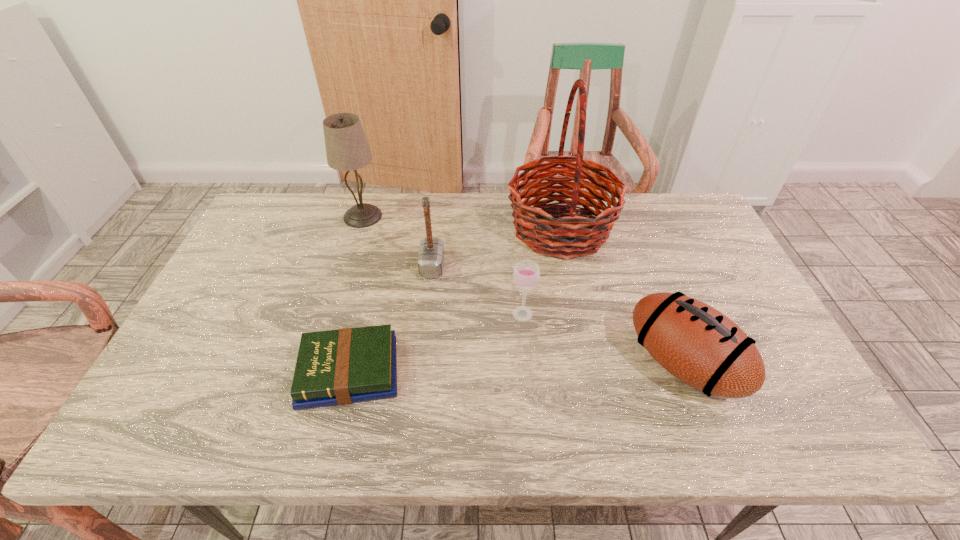
This screenshot has height=540, width=960. I want to click on object located in the near right corner section of the desktop, so tap(699, 345).

What are the coordinates of `vacant space at the far edge of the desktop` in the screenshot? It's located at (483, 224).

At what (x,y) coordinates should I click in order to perform the action: click on vacant space at the near edge of the desktop. Please return your answer as a coordinate pair (x, y). This screenshot has width=960, height=540. Looking at the image, I should click on (319, 430).

Identify the location of free region at the left edge. (172, 392).

The image size is (960, 540). I want to click on vacant space at the right edge, so click(780, 373).

Image resolution: width=960 pixels, height=540 pixels. In the image, there is a desktop. Find the location of `vacant space at the near left corner`. vacant space at the near left corner is located at coordinates point(162,417).

Locate an element on the screen. This screenshot has width=960, height=540. vacant area that lies between the wineglass and the third tallest object is located at coordinates (477, 290).

Identify the location of free space that is in between the tallest object and the football (American). (621, 296).

Locate an element on the screen. free space between the football (American) and the fourth shortest object is located at coordinates (558, 315).

The image size is (960, 540). I want to click on vacant point located between the third tallest object and the fifth shortest object, so click(x=397, y=241).